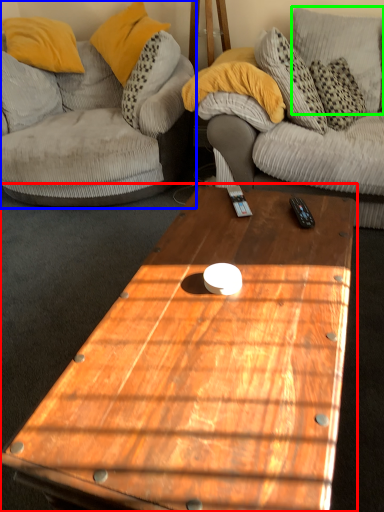
Question: Estimate the real-world distances between objects in this image. Which object is farther from coffee table (highlighted by a red box), studio couch (highlighted by a blue box) or pillow (highlighted by a green box)?

Choices:
 (A) studio couch
 (B) pillow

Answer: (B)